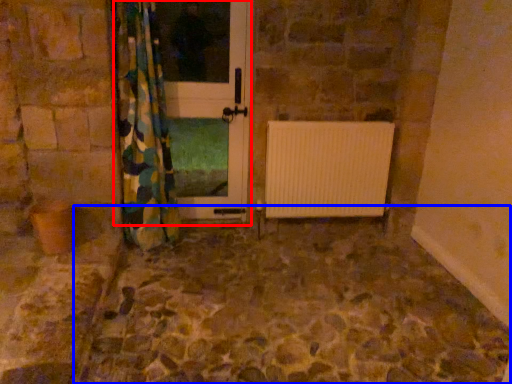
Question: Among these objects, which one is farthest to the camera, screen door (highlighted by a red box) or path (highlighted by a blue box)?

Choices:
 (A) screen door
 (B) path

Answer: (A)